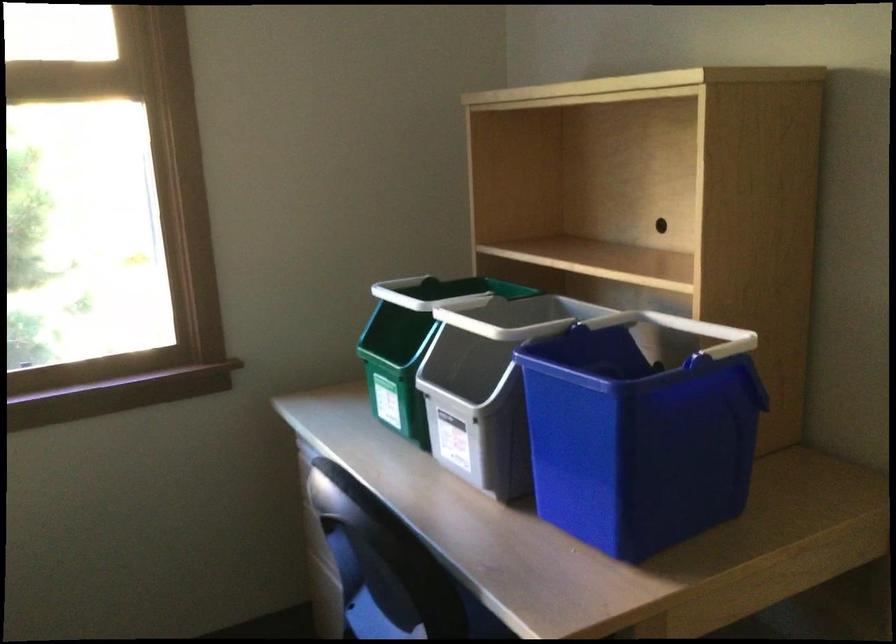
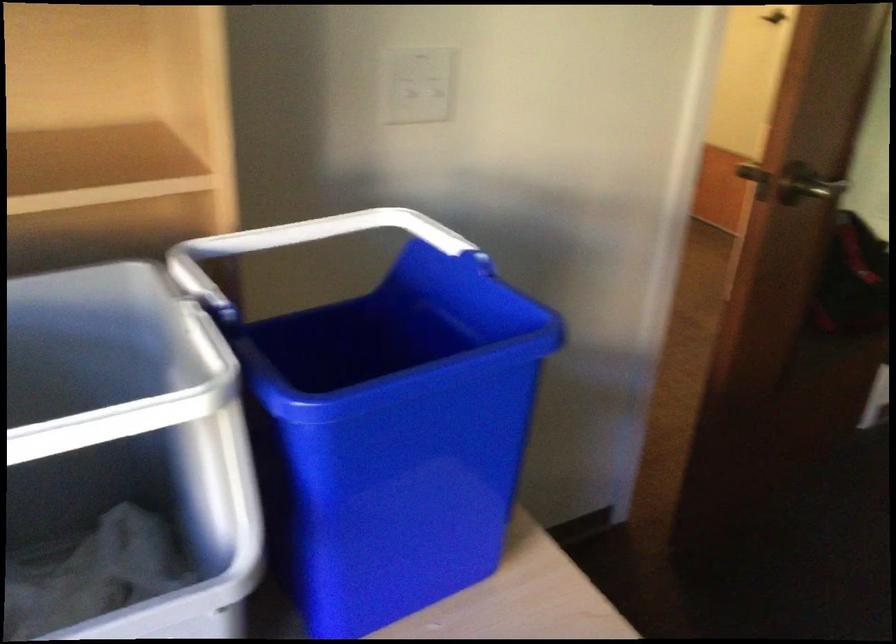
The point at (658, 319) is marked in the first image. Where is the corresponding point in the second image?

(213, 257)